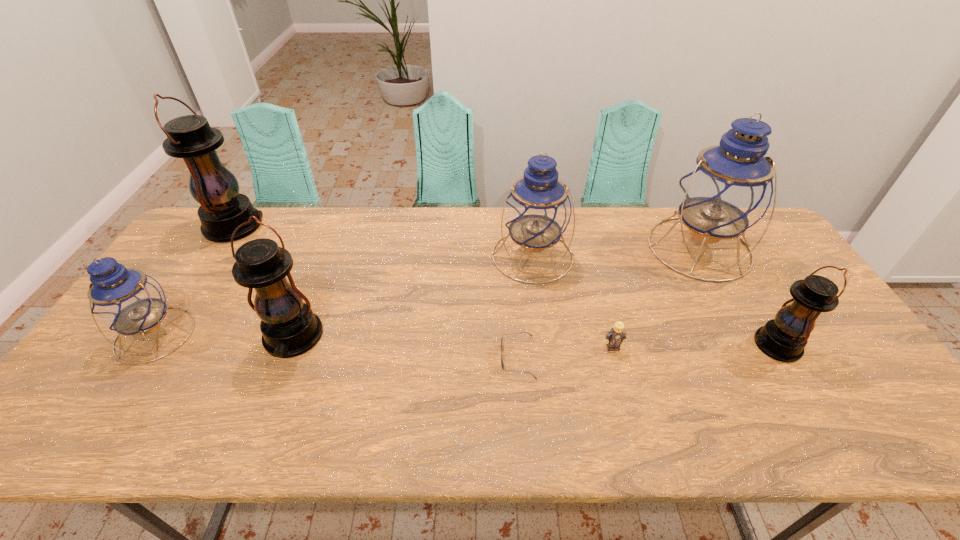
Identify the location of the sixth object from left to right. This screenshot has width=960, height=540. (615, 337).

Locate an element on the screen. This screenshot has height=540, width=960. the second shortest object is located at coordinates (615, 337).

Locate an element on the screen. Image resolution: width=960 pixels, height=540 pixels. black sunglasses is located at coordinates (502, 364).

This screenshot has width=960, height=540. Find the location of `sunglasses`. sunglasses is located at coordinates (502, 364).

Find a few locations in the blank space located above the farthest black lantern, indicating its light source. Please provide its 2D coordinates. Your answer should be formatted as a tuple, i.e. [(x, y)], where the tuple contains the x and y coordinates of a point satisfying the conditions above.

[(298, 226)]

You are a GUI agent. You are given a task and a screenshot of the screen. Output one action in this format:
    pyautogui.click(x=<x>, y=<y>)
    Task: Click on the vacant space situated 0.110m on the front-facing side of the rightmost blue lantern
    Image resolution: width=960 pixels, height=540 pixels.
    Given the screenshot: What is the action you would take?
    point(733,311)

Find the location of a particular element. vacant space positioned 0.240m on the front-facing side of the second biggest blue lantern is located at coordinates (544, 351).

Identify a few spots in free region located above the second biggest black lantern, indicating its light source. Please provide its 2D coordinates. Your answer should be formatted as a tuple, i.e. [(x, y)], where the tuple contains the x and y coordinates of a point satisfying the conditions above.

[(255, 436)]

What is the location of a free spot located 0.090m above the rightmost black lantern, indicating its light source? Please provide its 2D coordinates. Your answer should be formatted as a tuple, i.e. [(x, y)], where the tuple contains the x and y coordinates of a point satisfying the conditions above.

[(717, 345)]

Locate several points within vacant space located above the rightmost black lantern, indicating its light source. Please provide its 2D coordinates. Your answer should be formatted as a tuple, i.e. [(x, y)], where the tuple contains the x and y coordinates of a point satisfying the conditions above.

[(663, 345)]